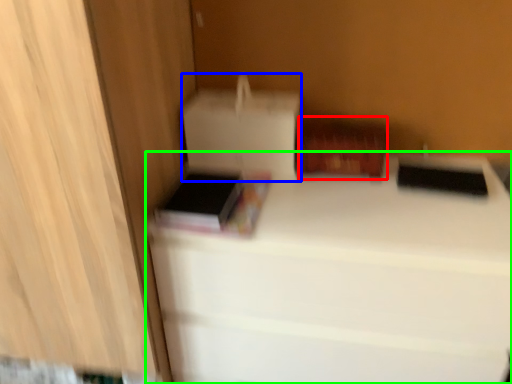
Question: Based on their relative distances, which object is nearer to cardboard box (highlighted by a red box)? Choose from cardboard box (highlighted by a blue box) and furniture (highlighted by a green box).

Choices:
 (A) cardboard box
 (B) furniture

Answer: (A)